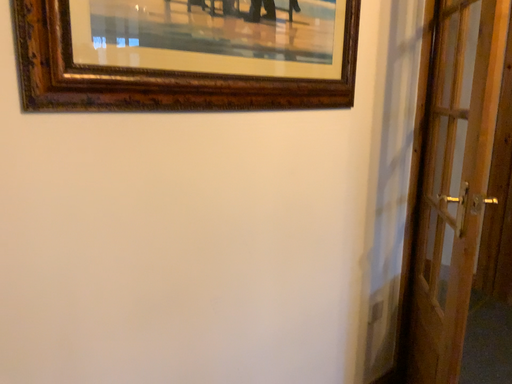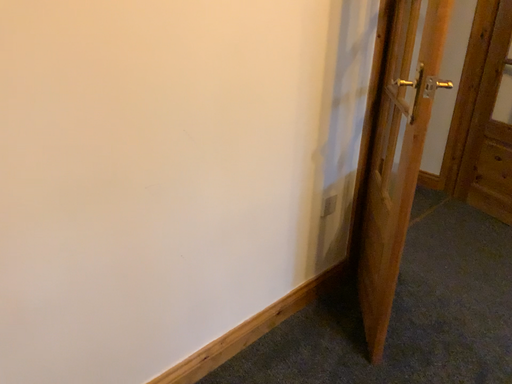
Question: Which way did the camera rotate in the video?

Choices:
 (A) rotated downward
 (B) rotated upward

Answer: (A)